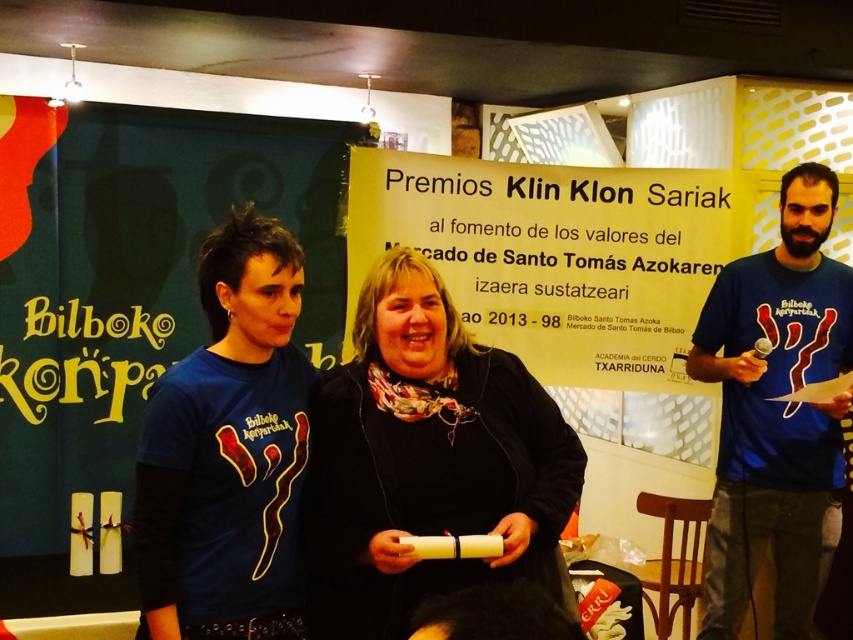
Between matte blue t-shirt at left and blue cotton t-shirt at right, which one appears on the left side from the viewer's perspective?

matte blue t-shirt at left is more to the left.

Does point (283, 266) lie behind point (751, 333)?

That is False.

You are a GUI agent. You are given a task and a screenshot of the screen. Output one action in this format:
    pyautogui.click(x=<x>, y=<y>)
    Task: Click on the matte blue t-shirt at left
    The image size is (853, 640).
    Given the screenshot: What is the action you would take?
    pyautogui.click(x=228, y=451)

In the scene shown: Who is lower down, black matte scarf at center or blue cotton t-shirt at right?

blue cotton t-shirt at right is below.

Can you confirm if black matte scarf at center is positioned to the right of blue cotton t-shirt at right?

Incorrect, black matte scarf at center is not on the right side of blue cotton t-shirt at right.

Is point (434, 580) positioned behind point (801, 381)?

No.

Find the location of a particular element. This screenshot has width=853, height=640. black matte scarf at center is located at coordinates (426, 460).

Is black matte scarf at center positioned at the back of matte blue t-shirt at left?

That is False.

Is point (576, 470) less distant than point (163, 538)?

No, it is behind (163, 538).

Locate an element on the screen. The image size is (853, 640). black matte scarf at center is located at coordinates (426, 460).